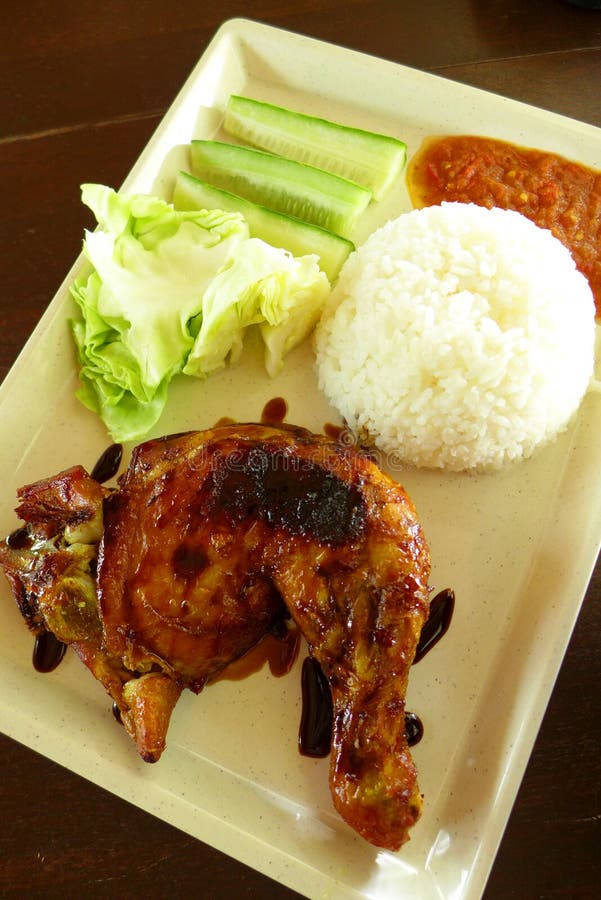
The image size is (601, 900). I want to click on table, so click(x=572, y=819).